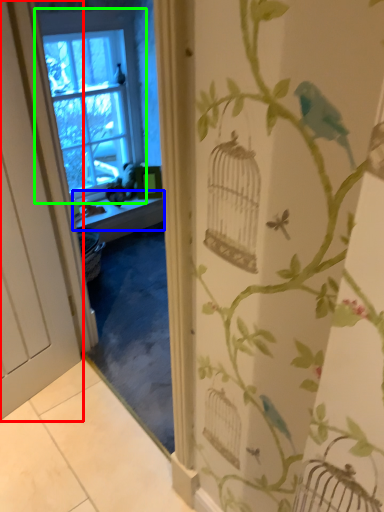
Question: Which is farther away from door (highlighted by a red box)? window sill (highlighted by a blue box) or window (highlighted by a green box)?

Choices:
 (A) window sill
 (B) window

Answer: (B)